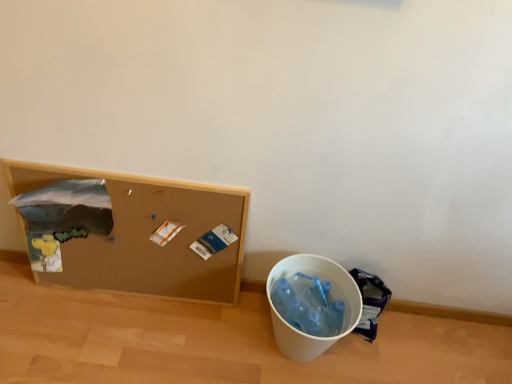
Question: Is brown corkboard at left at the right side of blue plastic bag at lower right?

Choices:
 (A) yes
 (B) no

Answer: (B)

Question: Is blue plastic bag at lower right located within brown corkboard at left?

Choices:
 (A) yes
 (B) no

Answer: (B)

Question: Does brown corkboard at left have a greater height compared to blue plastic bag at lower right?

Choices:
 (A) yes
 (B) no

Answer: (A)

Question: Is brown corkboard at left to the left of blue plastic bag at lower right from the viewer's perspective?

Choices:
 (A) yes
 (B) no

Answer: (A)

Question: Can you confirm if brown corkboard at left is bigger than blue plastic bag at lower right?

Choices:
 (A) no
 (B) yes

Answer: (B)

Question: Is brown corkboard at left positioned with its back to blue plastic bag at lower right?

Choices:
 (A) no
 (B) yes

Answer: (A)

Question: Considering the relative sizes of white plastic bucket at lower right and brown corkboard at left in the image provided, is white plastic bucket at lower right shorter than brown corkboard at left?

Choices:
 (A) no
 (B) yes

Answer: (B)

Question: Considering the relative sizes of white plastic bucket at lower right and brown corkboard at left in the image provided, is white plastic bucket at lower right bigger than brown corkboard at left?

Choices:
 (A) yes
 (B) no

Answer: (B)

Question: From the image's perspective, does white plastic bucket at lower right appear higher than brown corkboard at left?

Choices:
 (A) no
 (B) yes

Answer: (A)

Question: Can you confirm if white plastic bucket at lower right is thinner than brown corkboard at left?

Choices:
 (A) yes
 (B) no

Answer: (B)

Question: Is white plastic bucket at lower right behind brown corkboard at left?

Choices:
 (A) no
 (B) yes

Answer: (B)

Question: Considering the relative sizes of white plastic bucket at lower right and brown corkboard at left in the image provided, is white plastic bucket at lower right smaller than brown corkboard at left?

Choices:
 (A) yes
 (B) no

Answer: (A)

Question: Is white plastic bucket at lower right oriented towards blue plastic bag at lower right?

Choices:
 (A) no
 (B) yes

Answer: (A)